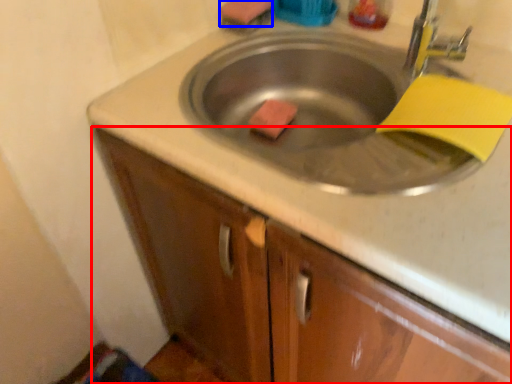
Question: Which of the following is the closest to the observer, cabinetry (highlighted by a red box) or soap (highlighted by a blue box)?

Choices:
 (A) cabinetry
 (B) soap

Answer: (A)